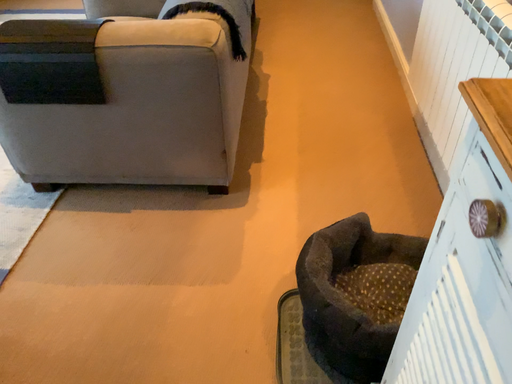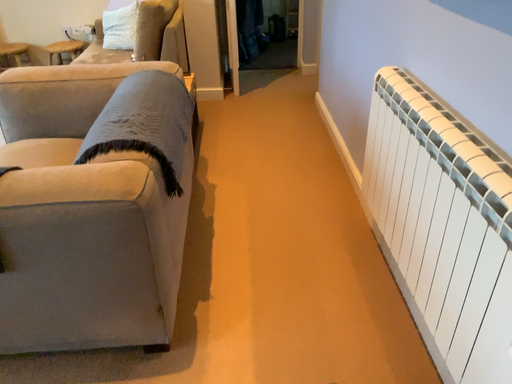
Question: How did the camera likely rotate when shooting the video?

Choices:
 (A) rotated downward
 (B) rotated upward

Answer: (B)